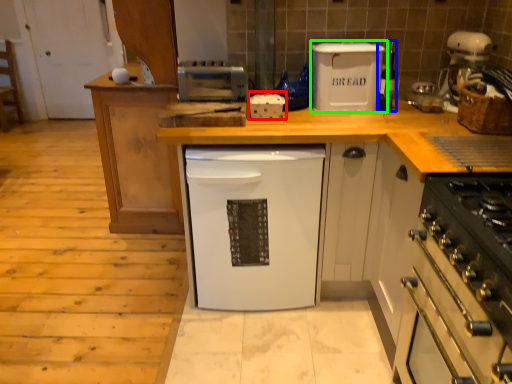
Question: Considering the real-world distances, which object is farthest from appliance (highlighted by a red box)? appliance (highlighted by a blue box) or kitchen appliance (highlighted by a green box)?

Choices:
 (A) appliance
 (B) kitchen appliance

Answer: (A)